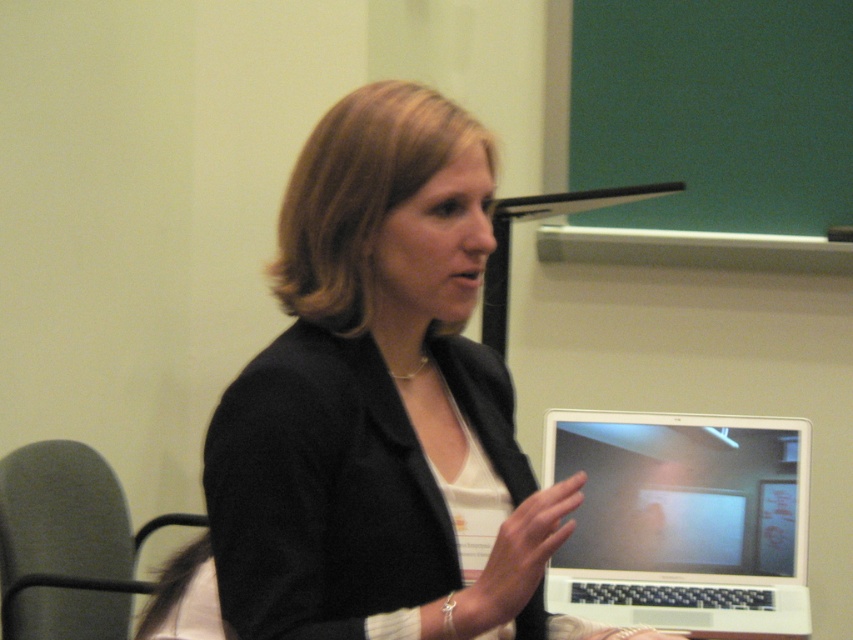
Between black matte blazer at center and green matte/blackboard at upper right, which one is positioned higher?

Positioned higher is green matte/blackboard at upper right.

Which of these two, black matte blazer at center or green matte/blackboard at upper right, stands shorter?

Standing shorter between the two is green matte/blackboard at upper right.

This screenshot has width=853, height=640. What do you see at coordinates (380, 403) in the screenshot?
I see `black matte blazer at center` at bounding box center [380, 403].

Identify the location of black matte blazer at center. The height and width of the screenshot is (640, 853). click(x=380, y=403).

Is point (717, 168) positioned behind point (547, 445)?

Yes, point (717, 168) is farther from viewer.

Does green matte/blackboard at upper right appear over white glossy laptop at lower right?

Indeed, green matte/blackboard at upper right is positioned over white glossy laptop at lower right.

Between point (820, 221) and point (582, 445), which one is positioned in front?

Point (582, 445) is more forward.

What are the coordinates of `green matte/blackboard at upper right` in the screenshot? It's located at point(714,112).

Which is in front, point (776, 568) or point (149, 531)?

Point (776, 568) is in front.

Between point (775, 525) and point (25, 580), which one is positioned behind?

Positioned behind is point (775, 525).

Is point (735, 432) less distant than point (91, 483)?

Yes, it is.

I want to click on white glossy laptop at lower right, so click(x=683, y=522).